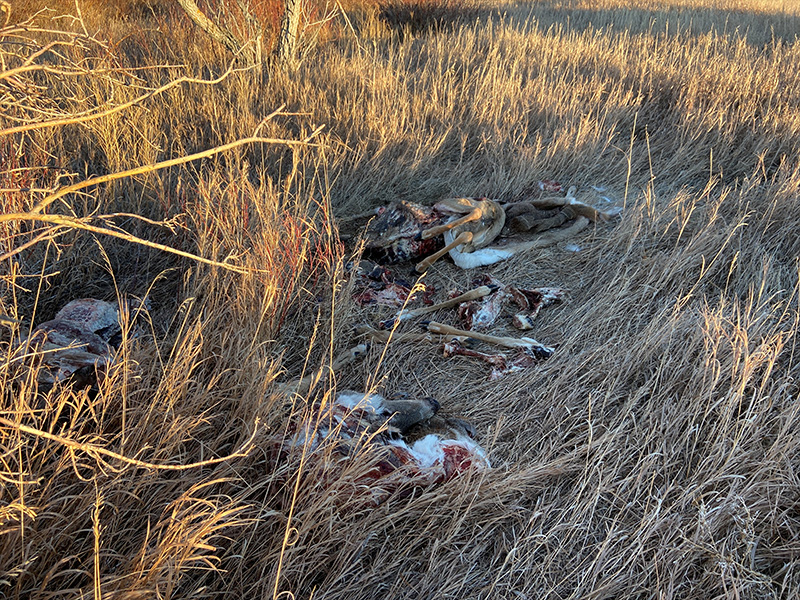
This screenshot has height=600, width=800. In order to click on animal heads in this screenshot , I will do `click(508, 310)`, `click(386, 418)`.